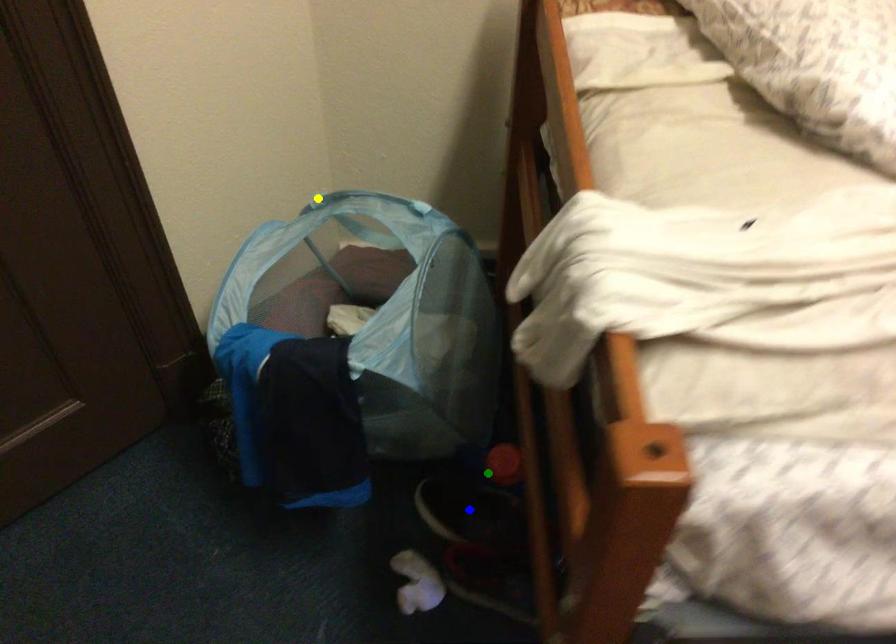
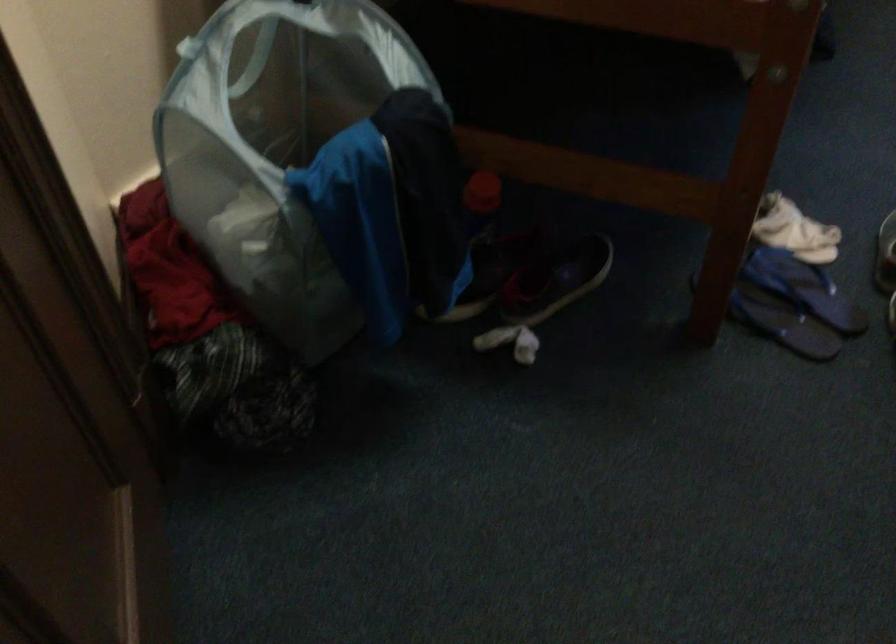
I am providing you with two images of the same scene from different viewpoints. Three points are marked in image1. Which point corresponds to a part or object that is occluded in image2?In image1, three points are marked. Which of them correspond to a part or object that is occluded in image2?Among the three points shown in image1, which one corresponds to a part or object that is no longer visible due to occlusion in image2?

Invisible in image2: blue point.